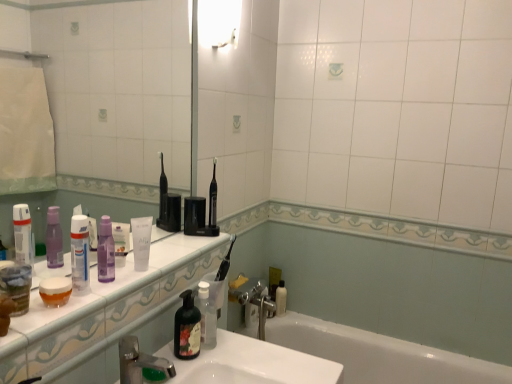
At what (x,y) coordinates should I click in order to perform the action: click on vacant space in between black plastic toothbrush at center and purple matte bottle at center. Please return your answer as a coordinate pair (x, y). Looking at the image, I should click on (165, 256).